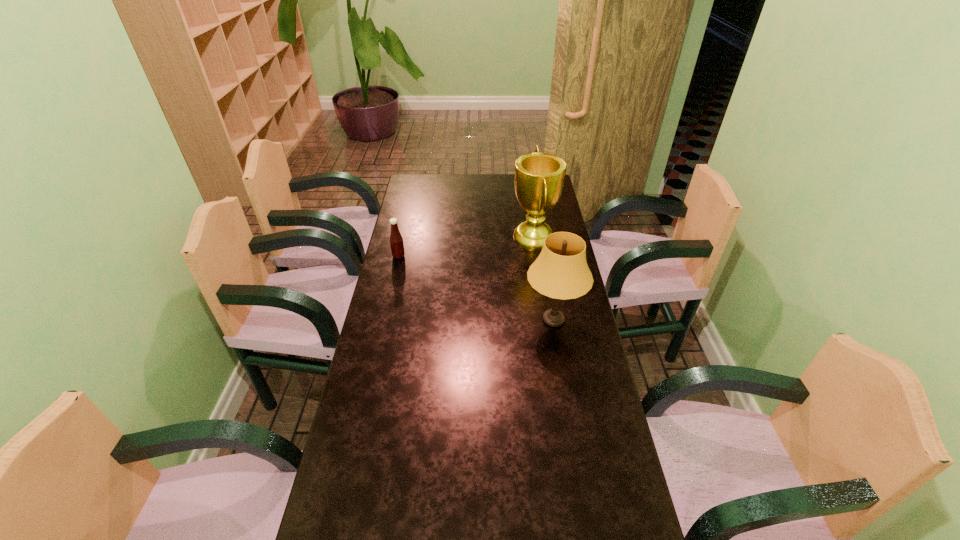
I want to click on award that is at the right edge, so click(x=539, y=177).

Identify the location of lampshade present at the right edge. Image resolution: width=960 pixels, height=540 pixels. (560, 272).

Where is `vacant area at the far edge of the desktop`? vacant area at the far edge of the desktop is located at coordinates (490, 183).

In the image, there is a desktop. Where is `free space at the left edge`? The height and width of the screenshot is (540, 960). free space at the left edge is located at coordinates [x=405, y=206].

In the image, there is a desktop. Where is `vacant space at the right edge`? vacant space at the right edge is located at coordinates (550, 217).

Find the location of `free space at the far left corner`. free space at the far left corner is located at coordinates (411, 174).

The width and height of the screenshot is (960, 540). I want to click on vacant area that lies between the Tabasco sauce and the lampshade, so click(x=476, y=288).

Locate an element on the screen. This screenshot has height=540, width=960. vacant space in between the lampshade and the shortest object is located at coordinates (476, 288).

I want to click on object that is the second closest to the award, so [x=396, y=241].

Select which object is the second closest to the award. Please provide its 2D coordinates. Your answer should be formatted as a tuple, i.e. [(x, y)], where the tuple contains the x and y coordinates of a point satisfying the conditions above.

[(396, 241)]